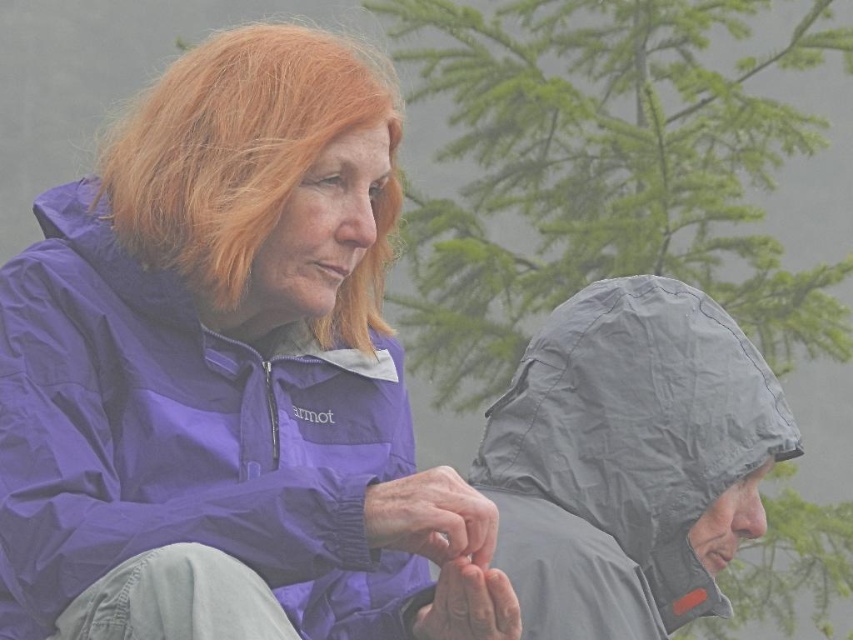
Is purple waterproof jacket at upper left thinner than gray waterproof hood at right?

No.

Does purple waterproof jacket at upper left appear on the left side of gray waterproof hood at right?

Indeed, purple waterproof jacket at upper left is positioned on the left side of gray waterproof hood at right.

Measure the distance between purple waterproof jacket at upper left and camera.

purple waterproof jacket at upper left and camera are 1.96 meters apart.

At what (x,y) coordinates should I click in order to perform the action: click on purple waterproof jacket at upper left. Please return your answer as a coordinate pair (x, y). Image resolution: width=853 pixels, height=640 pixels. Looking at the image, I should click on (229, 378).

Who is positioned more to the left, purple waterproof jacket at upper left or blonde hair at upper left?

blonde hair at upper left is more to the left.

Is purple waterproof jacket at upper left behind blonde hair at upper left?

No, purple waterproof jacket at upper left is closer to the viewer.

Identify the location of purple waterproof jacket at upper left. The image size is (853, 640). (229, 378).

Does gray waterproof hood at right appear on the left side of blonde hair at upper left?

Incorrect, gray waterproof hood at right is not on the left side of blonde hair at upper left.

Who is positioned more to the left, gray waterproof hood at right or blonde hair at upper left?

blonde hair at upper left

At what (x,y) coordinates should I click in order to perform the action: click on gray waterproof hood at right. Please return your answer as a coordinate pair (x, y). This screenshot has width=853, height=640. Looking at the image, I should click on (630, 460).

Where is `gray waterproof hood at right`? The width and height of the screenshot is (853, 640). gray waterproof hood at right is located at coordinates (630, 460).